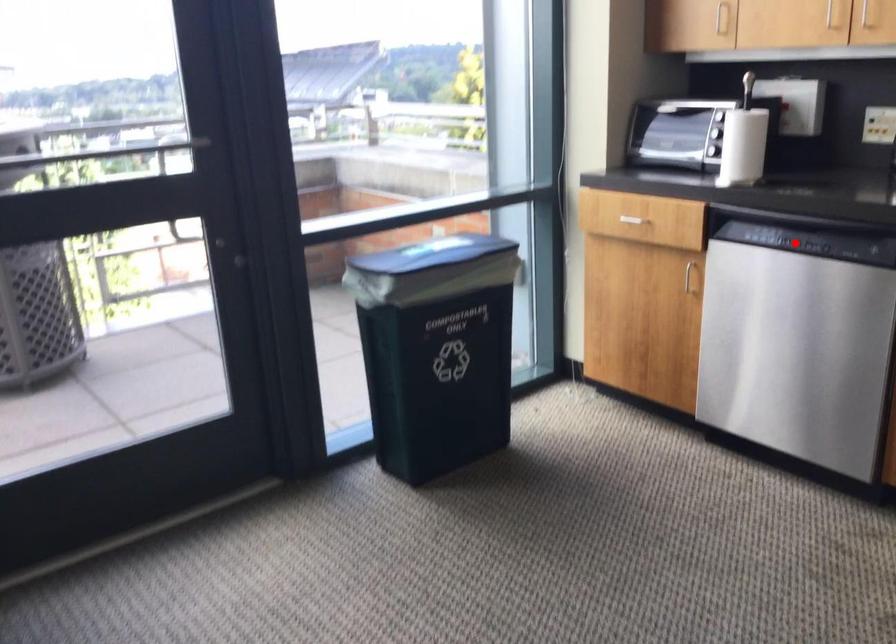
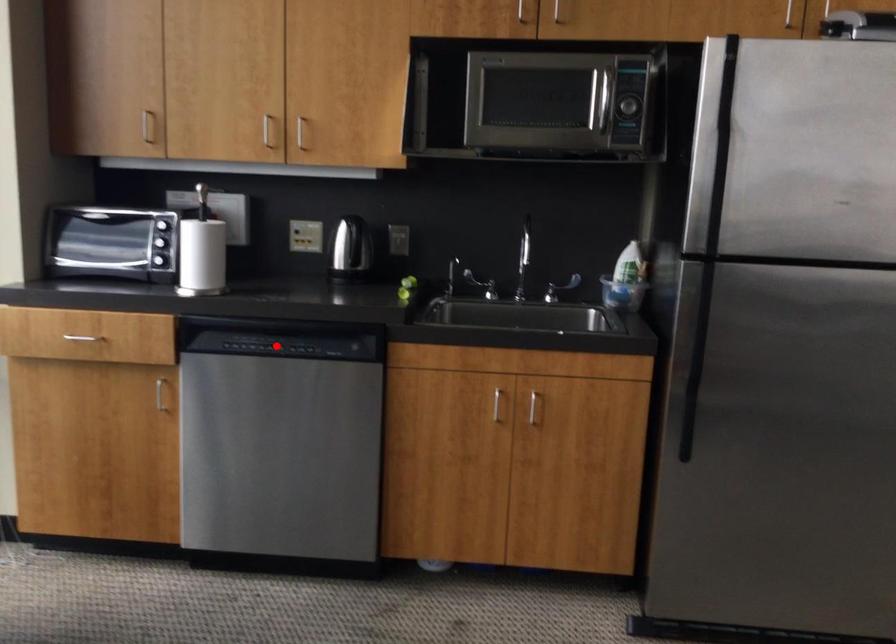
I am providing you with two images of the same scene from different viewpoints. A red point is marked on the first image and another point is marked on the second image. Is the red point in image1 aligned with the point shown in image2?

Yes